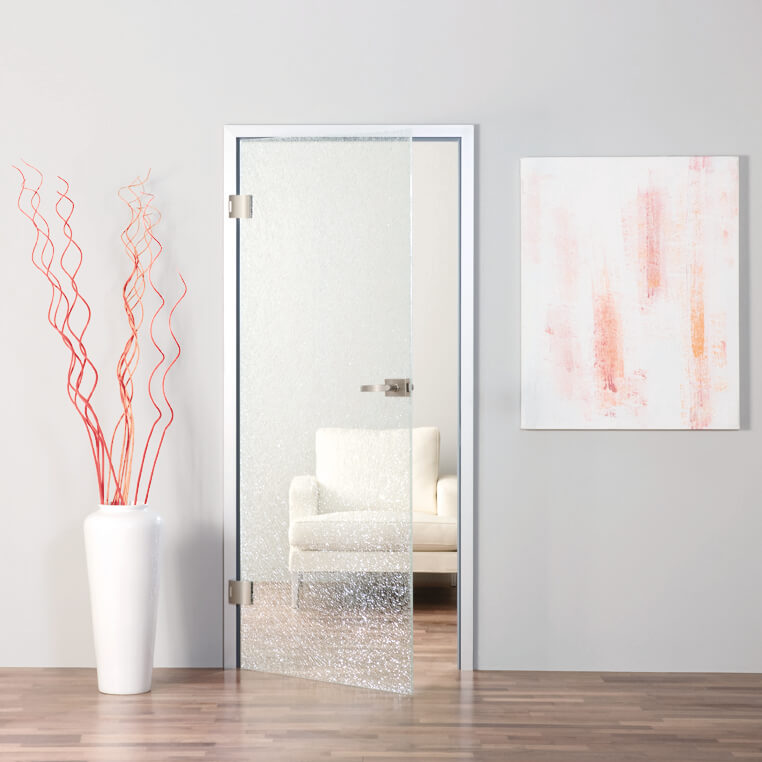
The image size is (762, 762). What are the coordinates of `painting` in the screenshot? It's located at click(658, 367).